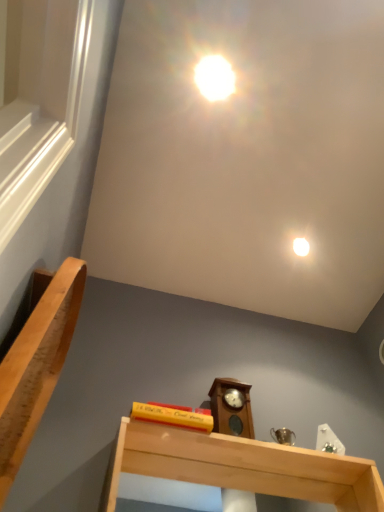
The height and width of the screenshot is (512, 384). Find the location of `free space behind white glossy droplight at upper center`. free space behind white glossy droplight at upper center is located at coordinates (306, 276).